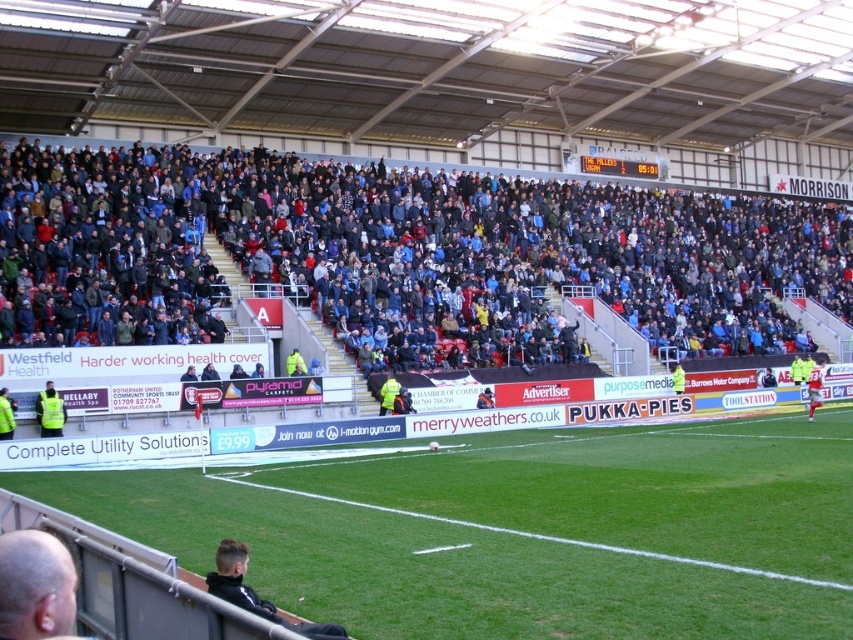
Question: Does yellow reflective vest at lower left lie behind red jersey at right?

Choices:
 (A) no
 (B) yes

Answer: (A)

Question: Observing the image, what is the correct spatial positioning of yellow reflective vest at lower left in reference to red jersey at right?

Choices:
 (A) right
 (B) left

Answer: (B)

Question: Which of these objects is positioned farthest from the green grass football field at center?

Choices:
 (A) yellow reflective vest at lower left
 (B) red jersey at right
 (C) bald head at lower left

Answer: (B)

Question: Which object is the farthest from the red jersey at right?

Choices:
 (A) green grass football field at center
 (B) bald head at lower left

Answer: (B)

Question: Does green grass football field at center lie behind bald head at lower left?

Choices:
 (A) no
 (B) yes

Answer: (B)

Question: Estimate the real-world distances between objects in this image. Which object is closer to the bald head at lower left?

Choices:
 (A) red jersey at right
 (B) green grass football field at center

Answer: (B)